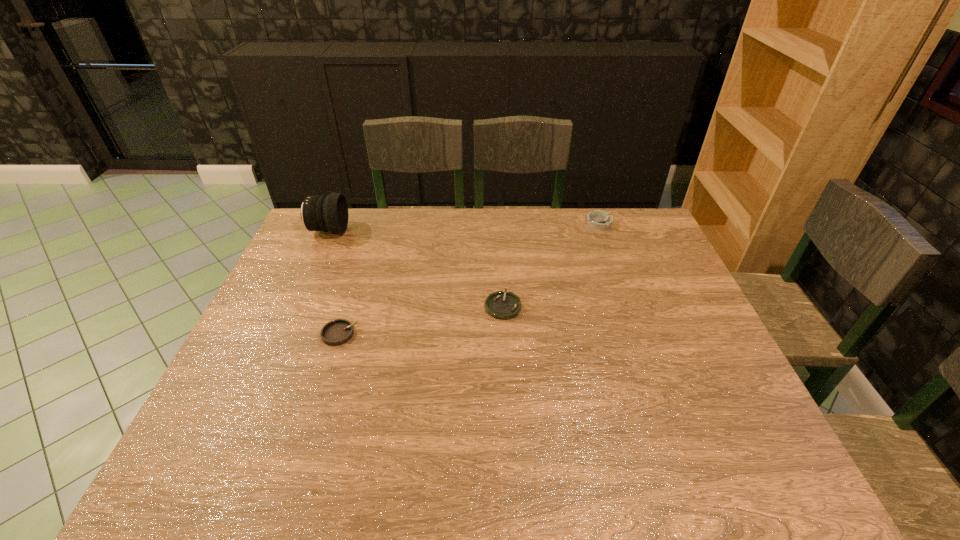
Where is `free spot between the shortest ashtray and the tallest object`? This screenshot has height=540, width=960. free spot between the shortest ashtray and the tallest object is located at coordinates (416, 268).

The width and height of the screenshot is (960, 540). In order to click on unoccupied position between the second tallest ashtray and the telephoto lens in this screenshot , I will do `click(334, 282)`.

Identify the location of free space that is in between the third farthest object and the rightmost ashtray. (551, 265).

At what (x,y) coordinates should I click in order to perform the action: click on free spot between the telephoto lens and the shortest object. Please return your answer as a coordinate pair (x, y). Looking at the image, I should click on (416, 268).

Where is `vacant area that lies between the shortest object and the third shortest object`? The image size is (960, 540). vacant area that lies between the shortest object and the third shortest object is located at coordinates (551, 265).

At what (x,y) coordinates should I click in order to perform the action: click on object that is the third closest to the second nearest ashtray. Please return your answer as a coordinate pair (x, y). Image resolution: width=960 pixels, height=540 pixels. Looking at the image, I should click on (329, 213).

I want to click on object that is the third nearest to the second nearest ashtray, so click(x=329, y=213).

At what (x,y) coordinates should I click in order to perform the action: click on ashtray that stands as the closest to the leftmost ashtray. Please return your answer as a coordinate pair (x, y). This screenshot has height=540, width=960. Looking at the image, I should click on (501, 305).

Identify the location of the second closest ashtray to the second object from left to right. (600, 220).

You are a GUI agent. You are given a task and a screenshot of the screen. Output one action in this format:
    pyautogui.click(x=<x>, y=<y>)
    Task: Click on the vacant region that satisfies the following two spatial constraints: 1. on the back side of the second ashtray from right to left; 2. at the front element of the telephoto lens
    The height and width of the screenshot is (540, 960).
    Given the screenshot: What is the action you would take?
    pyautogui.click(x=499, y=231)